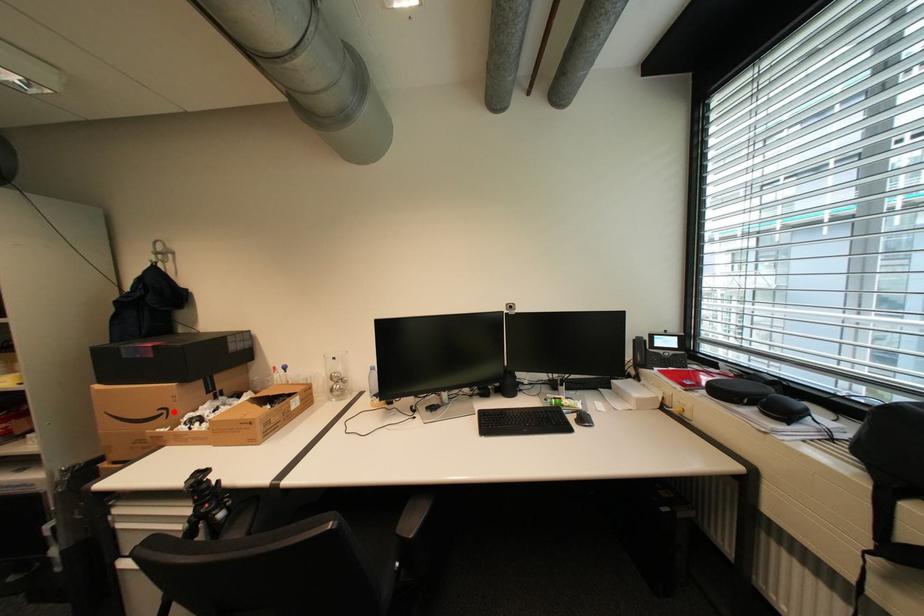
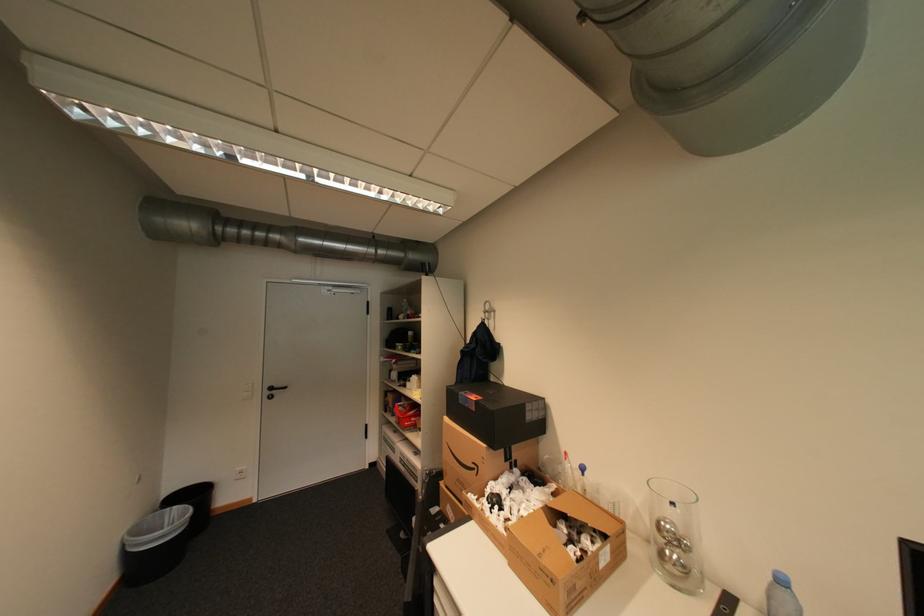
Where in the second image is the point corresponding to the highlighted location from the first image?

(484, 468)